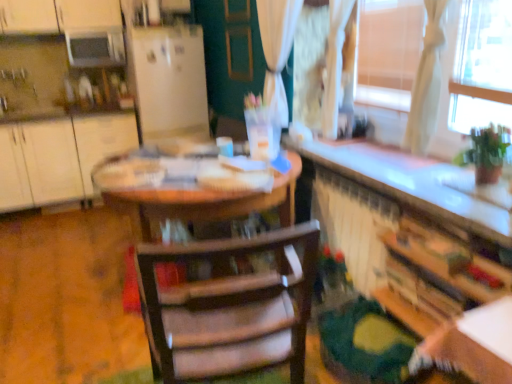
Describe the element at coordinates (230, 309) in the screenshot. This screenshot has width=512, height=384. I see `wooden chair at center` at that location.

What do you see at coordinates (96, 47) in the screenshot?
I see `white glossy microwave at upper left` at bounding box center [96, 47].

The height and width of the screenshot is (384, 512). Find the location of `matte brown screen door at center`. matte brown screen door at center is located at coordinates point(239,43).

I want to click on white matte refrigerator at center, so click(169, 81).

Which of these two, matte brown screen door at center or wooden bookshelf at lower right, placed as the 2th cabinetry when sorted from left to right, is thinner?

matte brown screen door at center.

Does point (250, 78) appear closer or farther from the camera than point (394, 286)?

Point (250, 78) is farther from the camera than point (394, 286).

Is matte brown screen door at center positioned with its back to wooden bookshelf at lower right, placed as the 2th cabinetry when sorted from left to right?

That's not correct — matte brown screen door at center is not looking away from wooden bookshelf at lower right, placed as the 2th cabinetry when sorted from left to right.

Is matte brown screen door at center directly adjacent to wooden bookshelf at lower right, which is the 1th cabinetry from bottom to top?

No, matte brown screen door at center is not making contact with wooden bookshelf at lower right, which is the 1th cabinetry from bottom to top.

Between point (178, 75) and point (160, 327), which one is positioned behind?

The point (178, 75) is farther.

Can we say white matte refrigerator at center lies outside wooden chair at center?

Yes.

Are white matte refrigerator at center and wooden chair at center far apart?

Yes.

From a real-world perspective, who is located higher, wooden chair at center or matte brown screen door at center?

matte brown screen door at center.

How many degrees apart are the facing directions of wooden chair at center and matte brown screen door at center?

The angle between the facing direction of wooden chair at center and the facing direction of matte brown screen door at center is 99.3 degrees.

From the image's perspective, which one is positioned higher, wooden chair at center or matte brown screen door at center?

From the image's view, matte brown screen door at center is above.

Is wooden chair at center aimed at matte brown screen door at center?

Yes, wooden chair at center is aimed at matte brown screen door at center.

Does white matte refrigerator at center have a smaller size compared to wooden bookshelf at lower right, which is the 1th cabinetry from bottom to top?

No, white matte refrigerator at center is not smaller than wooden bookshelf at lower right, which is the 1th cabinetry from bottom to top.

Consider the image. Based on their positions, is white matte refrigerator at center located to the left or right of wooden bookshelf at lower right, which appears as the 2th cabinetry when viewed from the back?

Based on their positions, white matte refrigerator at center is located to the left of wooden bookshelf at lower right, which appears as the 2th cabinetry when viewed from the back.

What's the angular difference between white matte refrigerator at center and wooden bookshelf at lower right, which is the 1th cabinetry from bottom to top,'s facing directions?

The facing directions of white matte refrigerator at center and wooden bookshelf at lower right, which is the 1th cabinetry from bottom to top, are 94.9 degrees apart.

Is white matte refrigerator at center at the right side of white matte cabinet at left, the 2th cabinetry from the front?

Yes, white matte refrigerator at center is to the right of white matte cabinet at left, the 2th cabinetry from the front.

The width and height of the screenshot is (512, 384). I want to click on fridge above the white matte cabinet at left, the 1th cabinetry positioned from the left (from the image's perspective), so click(169, 81).

Which of these two, white matte refrigerator at center or white matte cabinet at left, which is the first cabinetry from back to front, stands taller?

white matte refrigerator at center.

Would you consider white matte refrigerator at center to be distant from white matte cabinet at left, the 2th cabinetry from the front?

No.

Does point (84, 138) come closer to viewer compared to point (148, 110)?

No.

From a real-world perspective, starting from the white matte refrigerator at center, which cabinetry is the 1st one below it? Please provide its 2D coordinates.

[(58, 157)]

Choose the correct answer: Is white matte cabinet at left, which is the first cabinetry in top-to-bottom order, inside white matte refrigerator at center or outside it?

white matte cabinet at left, which is the first cabinetry in top-to-bottom order, is not inside white matte refrigerator at center, it's outside.

Can you tell me how much white matte refrigerator at center and white glossy microwave at upper left differ in facing direction?

The angular difference between white matte refrigerator at center and white glossy microwave at upper left is 4.99 degrees.

Can you confirm if white matte refrigerator at center is smaller than white glossy microwave at upper left?

No, white matte refrigerator at center is not smaller than white glossy microwave at upper left.

Considering the sizes of objects white matte refrigerator at center and white glossy microwave at upper left in the image provided, who is shorter, white matte refrigerator at center or white glossy microwave at upper left?

white glossy microwave at upper left is shorter.

Based on the photo, is white matte refrigerator at center facing away from white glossy microwave at upper left?

That's not correct — white matte refrigerator at center is not looking away from white glossy microwave at upper left.

Identify the location of screen door that is above the wooden bookshelf at lower right, which is the 1th cabinetry from bottom to top (from the image's perspective). This screenshot has height=384, width=512. (239, 43).

Identify the location of fridge on the left of wooden chair at center. coord(169,81).

When comparing their distances from matte brown screen door at center, does wooden chair at center or white matte refrigerator at center seem closer?

white matte refrigerator at center is closer to matte brown screen door at center.

Based on their spatial positions, is wooden chair at center or white matte refrigerator at center further from white matte cabinet at left, which is the first cabinetry in top-to-bottom order?

wooden chair at center lies further to white matte cabinet at left, which is the first cabinetry in top-to-bottom order, than the other object.

Which object lies further to the anchor point matte brown screen door at center, white glossy microwave at upper left or wooden chair at center?

wooden chair at center is positioned further to the anchor matte brown screen door at center.

From the picture: Considering their positions, is white glossy microwave at upper left positioned further to white matte cabinet at left, which is the first cabinetry in top-to-bottom order, than wooden bookshelf at lower right, the first cabinetry viewed from the front?

Based on the image, wooden bookshelf at lower right, the first cabinetry viewed from the front, appears to be further to white matte cabinet at left, which is the first cabinetry in top-to-bottom order.

When comparing their distances from matte brown screen door at center, does white matte refrigerator at center or wooden bookshelf at lower right, which is the 1th cabinetry from bottom to top, seem closer?

white matte refrigerator at center lies closer to matte brown screen door at center than the other object.

Consider the image. Which object lies further to the anchor point white glossy microwave at upper left, white matte refrigerator at center or white matte cabinet at left, the 1th cabinetry positioned from the left?

Among the two, white matte cabinet at left, the 1th cabinetry positioned from the left, is located further to white glossy microwave at upper left.

From the image, which object appears to be nearer to wooden chair at center, white matte refrigerator at center or wooden bookshelf at lower right, the first cabinetry viewed from the front?

Based on the image, wooden bookshelf at lower right, the first cabinetry viewed from the front, appears to be nearer to wooden chair at center.

Looking at this image, looking at the image, which one is located further to wooden bookshelf at lower right, which is the 1th cabinetry from bottom to top, wooden chair at center or white glossy microwave at upper left?

Based on the image, white glossy microwave at upper left appears to be further to wooden bookshelf at lower right, which is the 1th cabinetry from bottom to top.

Locate an element on the screen. screen door located between wooden chair at center and white matte cabinet at left, which is the first cabinetry from back to front, in the depth direction is located at coordinates (239, 43).

This screenshot has width=512, height=384. Identify the location of chair situated between white matte cabinet at left, the 2th cabinetry from the front, and wooden bookshelf at lower right, which is the 1th cabinetry from bottom to top, from left to right. (230, 309).

At what (x,y) coordinates should I click in order to perform the action: click on fridge located between white matte cabinet at left, arranged as the 2th cabinetry when viewed from the right, and wooden bookshelf at lower right, the first cabinetry viewed from the front, in the left-right direction. Please return your answer as a coordinate pair (x, y). Looking at the image, I should click on (169, 81).

Locate an element on the screen. The width and height of the screenshot is (512, 384). screen door between wooden chair at center and white matte refrigerator at center along the z-axis is located at coordinates (239, 43).